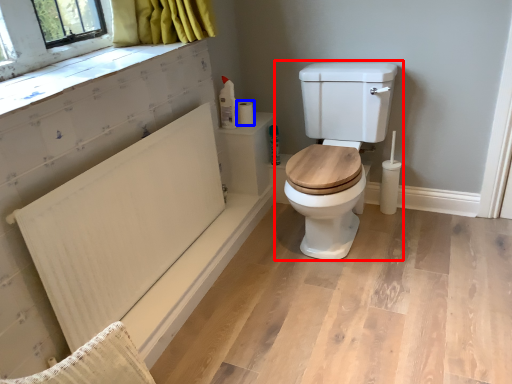
Question: Which object is further to the camera taking this photo, toilet (highlighted by a red box) or toilet paper (highlighted by a blue box)?

Choices:
 (A) toilet
 (B) toilet paper

Answer: (B)